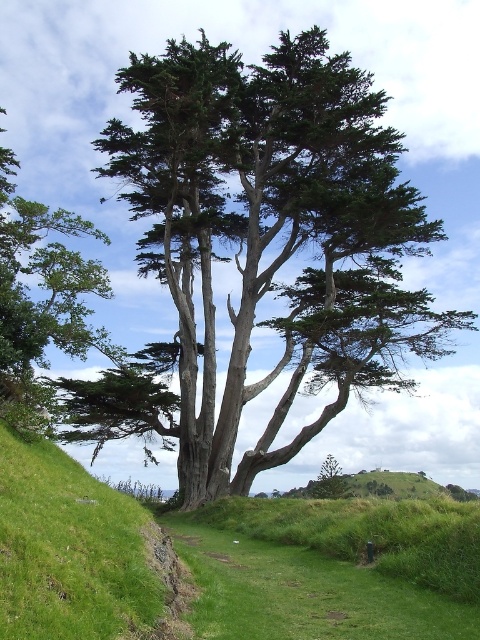
From the picture: You are standing in the middle of the grassy slope and looking towards the tree. Which object is closer to your feet? Please choose between the green grassy at lower center and the green rough bark tree at upper center.

The green grassy at lower center is closer to your feet because it is located below the green rough bark tree at upper center.

From the picture: You are a gardener planning to plant a new flower bed between the green grassy at lower center and the green rough bark tree at upper center. Which area should you choose to ensure the flowers receive adequate sunlight, considering their height requirements?

The green grassy at lower center is shorter than the green rough bark tree at upper center, so planting the flower bed there would allow the flowers to receive more sunlight since they are less obstructed by the taller tree.